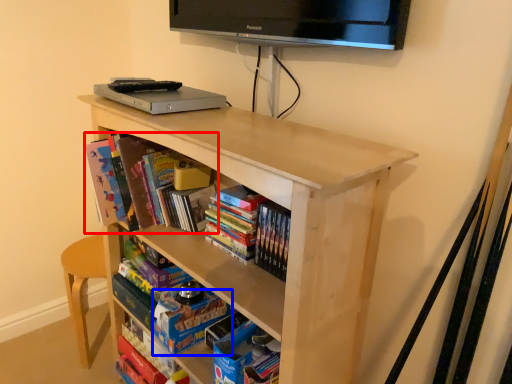
Question: Which object appears closest to the camera in this image, book (highlighted by a red box) or paperback book (highlighted by a blue box)?

Choices:
 (A) book
 (B) paperback book

Answer: (A)